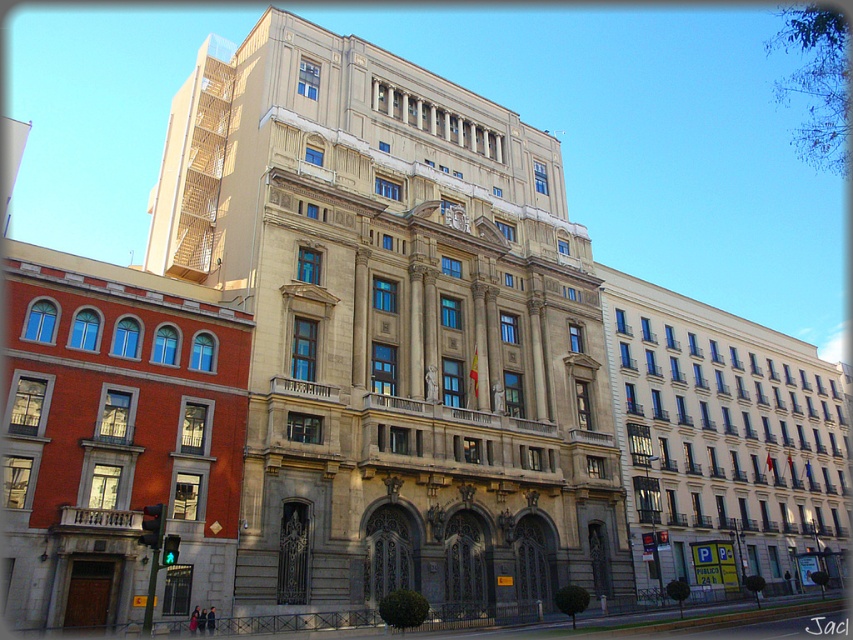
Does beige stone building at center have a smaller size compared to gold metallic clock at center?

Actually, beige stone building at center might be larger than gold metallic clock at center.

Consider the image. Is beige stone building at center shorter than gold metallic clock at center?

In fact, beige stone building at center may be taller than gold metallic clock at center.

Between point (480, 268) and point (444, 220), which one is positioned behind?

The point (480, 268) is more distant.

This screenshot has width=853, height=640. Identify the location of beige stone building at center. (393, 328).